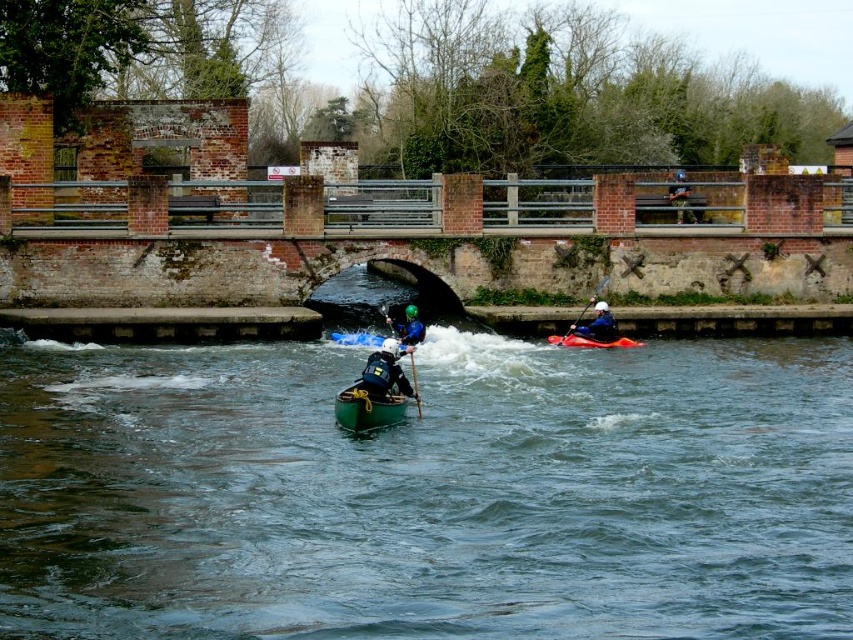
You are standing on the riverbank and see two points marked in the image. Which point is nearer to you, point (181, 499) or point (573, 333)?

Point (181, 499) is closer to the viewer than point (573, 333).

You are a photographer trying to capture a photo of the green helmeted kayaker at center and the orange plastic paddle at right. From your current position, which object is closer to the camera?

The orange plastic paddle at right is closer to the camera because the green helmeted kayaker at center is positioned under it, indicating that the paddle is in front of the kayaker in the visual plane.

You are a photographer trying to capture the kayakers. You notice the green helmeted kayaker at center and the orange plastic paddle at right. Which object should you focus on first if you want to photograph the one closer to the camera?

The green helmeted kayaker at center is in front of the orange plastic paddle at right, so you should focus on the green helmeted kayaker at center first since it is closer to the camera.